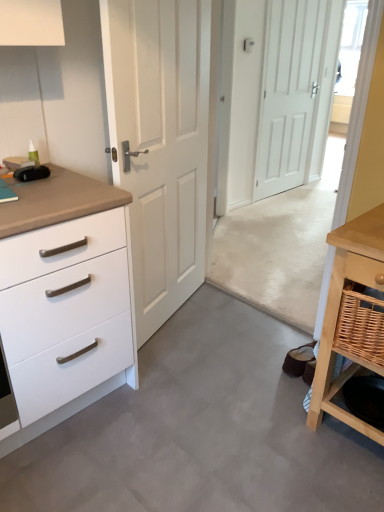
Question: Is white matte door at center, the first door in the back-to-front sequence, inside or outside of transparent glass door at upper right?

Choices:
 (A) outside
 (B) inside

Answer: (A)

Question: Considering the relative positions of white matte door at center, the first door viewed from the right, and transparent glass door at upper right in the image provided, is white matte door at center, the first door viewed from the right, to the left or to the right of transparent glass door at upper right?

Choices:
 (A) right
 (B) left

Answer: (B)

Question: Which is nearer to the woven brown basket at lower right?

Choices:
 (A) gray laminate floor at center
 (B) transparent glass door at upper right
 (C) white matte door at center, positioned as the second door in front-to-back order
 (D) white matte chest of drawers at left
 (E) white matte door at center, arranged as the first door when viewed from the left

Answer: (A)

Question: Which object is the closest to the woven brown basket at lower right?

Choices:
 (A) white matte door at center, the 2th door when ordered from back to front
 (B) transparent glass door at upper right
 (C) gray laminate floor at center
 (D) white matte door at center, placed as the 2th door when sorted from left to right
 (E) light wood table at lower right

Answer: (E)